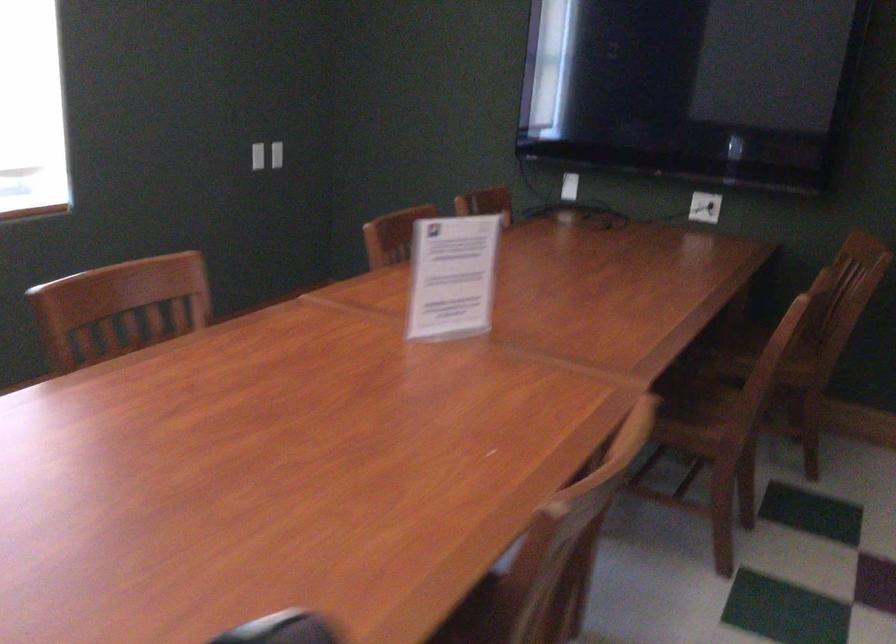
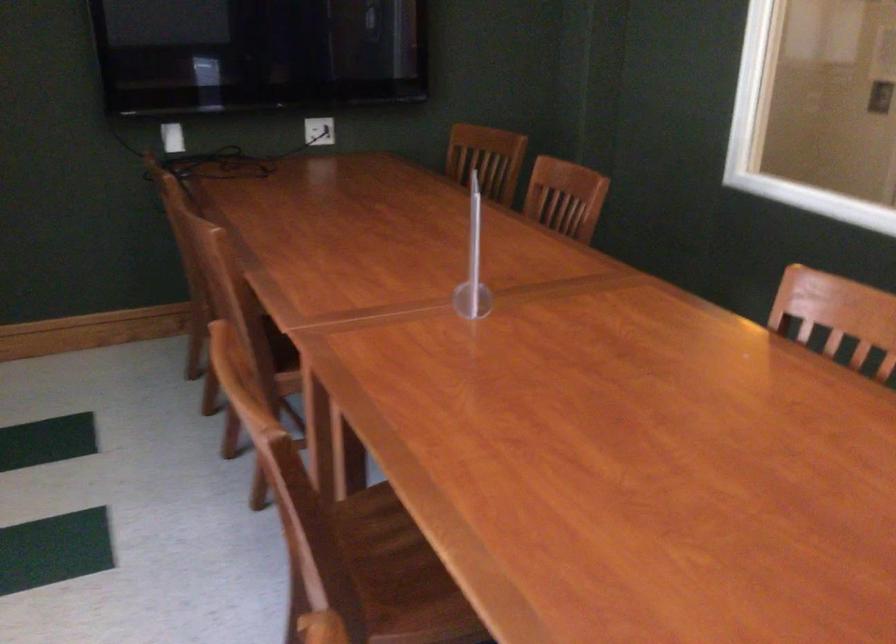
Find the pixel in the second image that matches [366,232] in the first image.

(216, 242)